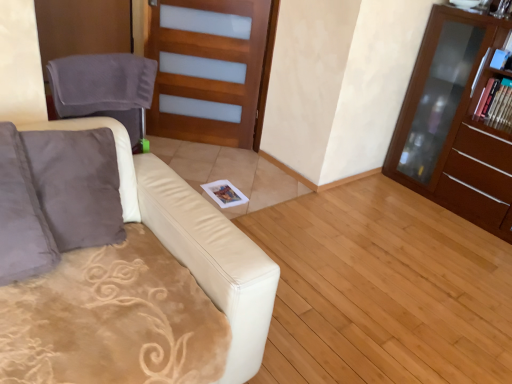
Question: Is light brown wood at center bigger than brown wood cabinet at right?

Choices:
 (A) no
 (B) yes

Answer: (A)

Question: Is light brown wood at center to the right of brown wood cabinet at right from the viewer's perspective?

Choices:
 (A) yes
 (B) no

Answer: (B)

Question: From a real-world perspective, is light brown wood at center over brown wood cabinet at right?

Choices:
 (A) no
 (B) yes

Answer: (A)

Question: Does light brown wood at center have a lesser height compared to brown wood cabinet at right?

Choices:
 (A) yes
 (B) no

Answer: (A)

Question: From the image's perspective, is light brown wood at center on top of brown wood cabinet at right?

Choices:
 (A) yes
 (B) no

Answer: (B)

Question: Is wooden frosted glass door at center inside the boundaries of light brown wood at center, or outside?

Choices:
 (A) inside
 (B) outside

Answer: (B)

Question: From a real-world perspective, is wooden frosted glass door at center positioned above or below light brown wood at center?

Choices:
 (A) above
 (B) below

Answer: (A)

Question: From their relative heights in the image, would you say wooden frosted glass door at center is taller or shorter than light brown wood at center?

Choices:
 (A) tall
 (B) short

Answer: (A)

Question: Is wooden frosted glass door at center wider or thinner than light brown wood at center?

Choices:
 (A) wide
 (B) thin

Answer: (B)

Question: Relative to matte cardboard magazine at upper right, is wooden frosted glass door at center in front or behind?

Choices:
 (A) behind
 (B) front

Answer: (A)

Question: Do you think wooden frosted glass door at center is within matte cardboard magazine at upper right, or outside of it?

Choices:
 (A) inside
 (B) outside

Answer: (B)

Question: From a real-world perspective, is wooden frosted glass door at center above or below matte cardboard magazine at upper right?

Choices:
 (A) above
 (B) below

Answer: (B)

Question: From the image's perspective, is wooden frosted glass door at center above or below matte cardboard magazine at upper right?

Choices:
 (A) below
 (B) above

Answer: (B)

Question: Does point (238, 124) appear closer or farther from the camera than point (442, 140)?

Choices:
 (A) closer
 (B) farther

Answer: (B)

Question: In terms of size, does wooden frosted glass door at center appear bigger or smaller than brown wood cabinet at right?

Choices:
 (A) big
 (B) small

Answer: (B)